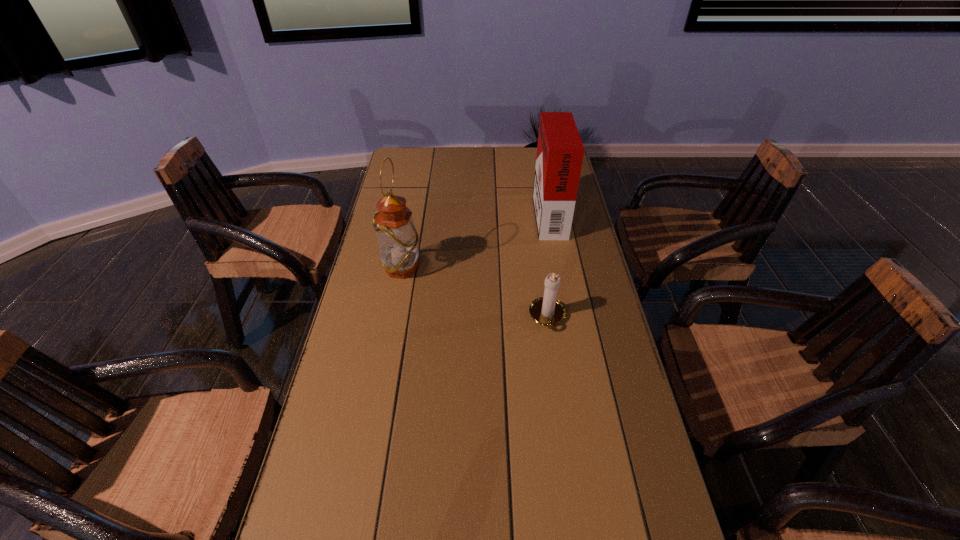
Find the location of a particular element. the second nearest object is located at coordinates (397, 238).

In order to click on oil lamp in this screenshot , I will do `click(397, 238)`.

This screenshot has height=540, width=960. Identify the location of cigarette case. (560, 151).

Identify the location of the nearest object. The height and width of the screenshot is (540, 960). (548, 311).

Identify the location of the shortest object. The height and width of the screenshot is (540, 960). (548, 311).

Locate an element on the screen. This screenshot has height=540, width=960. free location located 0.160m on the front of the leftmost object is located at coordinates (393, 323).

The width and height of the screenshot is (960, 540). Find the location of `vacant area situated on the front-facing side of the farthest object`. vacant area situated on the front-facing side of the farthest object is located at coordinates (474, 213).

Locate an element on the screen. free space located on the front-facing side of the farthest object is located at coordinates (518, 213).

Identify the location of free spot located on the front-facing side of the farthest object. The height and width of the screenshot is (540, 960). (425, 213).

You are a GUI agent. You are given a task and a screenshot of the screen. Output one action in this format:
    pyautogui.click(x=<x>, y=<y>)
    Task: Click on the vacant point located 0.290m on the handle side of the nearest object
    This screenshot has height=540, width=960.
    Given the screenshot: What is the action you would take?
    pyautogui.click(x=564, y=434)